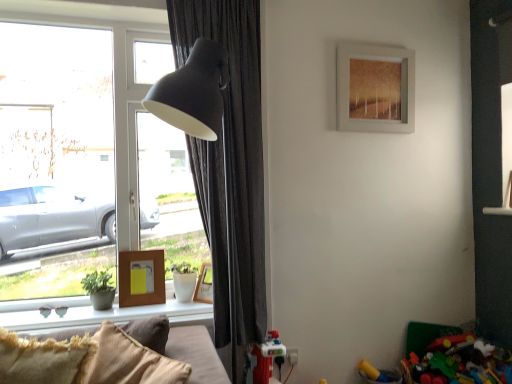
This screenshot has height=384, width=512. What are the coordinates of `vacant space to the right of woodenobject at lower left, which is the second picture frame in bottom-to-top order` in the screenshot? It's located at (175, 306).